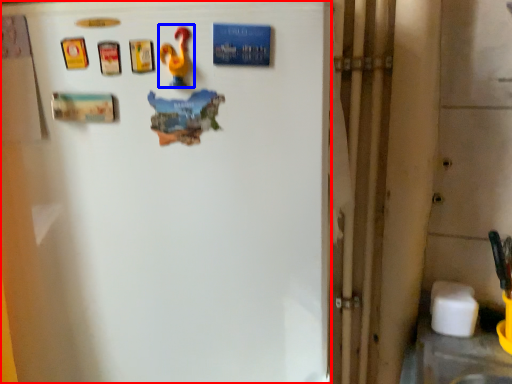
Question: Which of the following is the farthest to the observer, refrigerator (highlighted by a red box) or toy (highlighted by a blue box)?

Choices:
 (A) refrigerator
 (B) toy

Answer: (B)